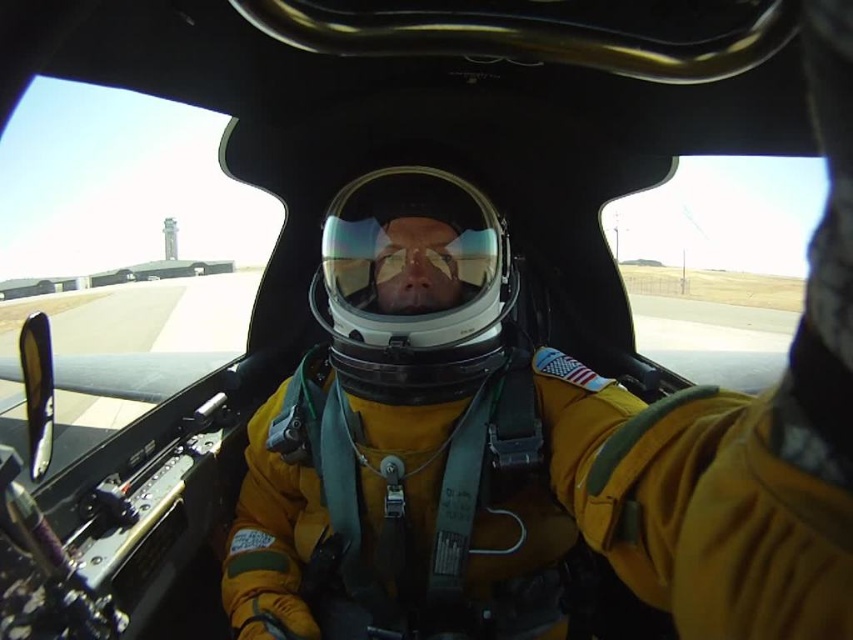
Question: Is yellow fabric helmet at center wider than transparent plastic helmet at center?

Choices:
 (A) no
 (B) yes

Answer: (B)

Question: Based on their relative distances, which object is nearer to the transparent plastic helmet at center?

Choices:
 (A) transparent reflective helmet at center
 (B) yellow fabric helmet at center

Answer: (A)

Question: Is transparent plastic helmet at center below transparent reflective helmet at center?

Choices:
 (A) no
 (B) yes

Answer: (B)

Question: Estimate the real-world distances between objects in this image. Which object is closer to the yellow fabric helmet at center?

Choices:
 (A) transparent reflective helmet at center
 (B) transparent plastic helmet at center

Answer: (B)

Question: Can you confirm if yellow fabric helmet at center is wider than transparent reflective helmet at center?

Choices:
 (A) no
 (B) yes

Answer: (B)

Question: Based on their relative distances, which object is nearer to the yellow fabric helmet at center?

Choices:
 (A) transparent plastic helmet at center
 (B) transparent reflective helmet at center

Answer: (A)